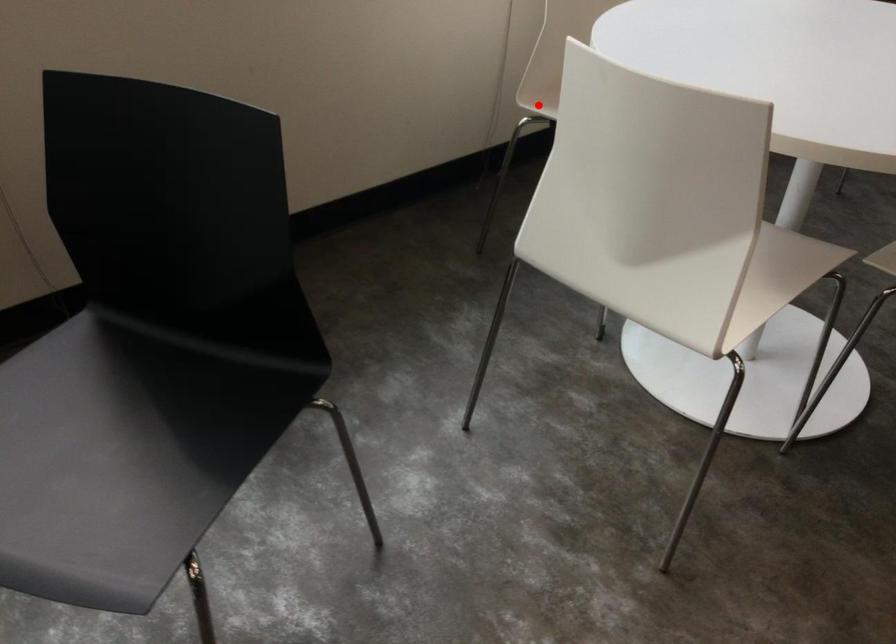
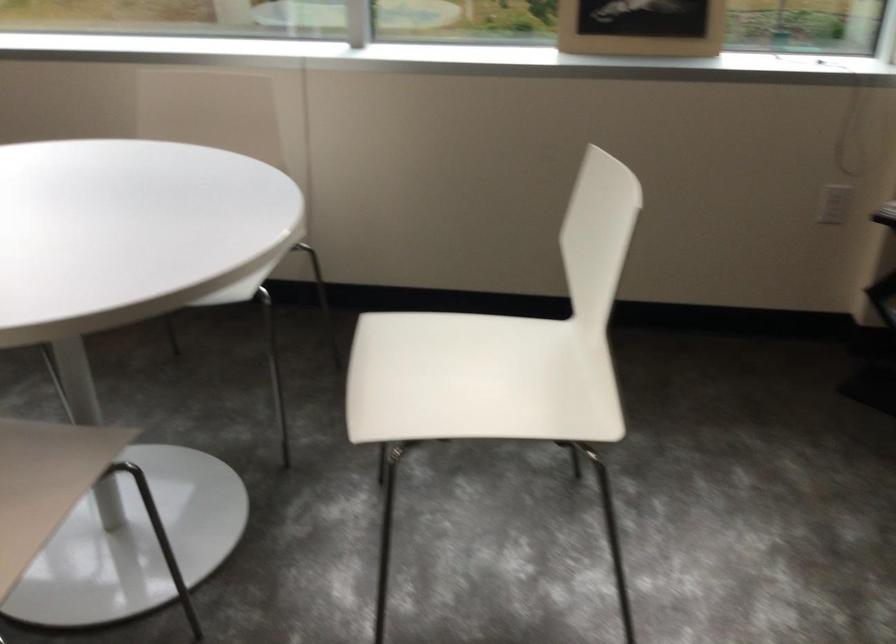
Question: I am providing you with two images of the same scene from different viewpoints. A red point is marked on the first image. At the location where the point appears in image 1, is it still visible in image 2?

Choices:
 (A) Yes
 (B) No

Answer: (B)